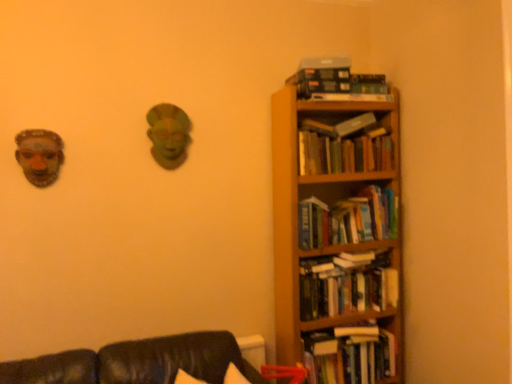
Question: From their relative heights in the image, would you say hardcover books at upper right, which is the first book in top-to-bottom order, is taller or shorter than wooden bookcase at right?

Choices:
 (A) tall
 (B) short

Answer: (B)

Question: Do you think hardcover books at upper right, which is the first book in top-to-bottom order, is within wooden bookcase at right, or outside of it?

Choices:
 (A) outside
 (B) inside

Answer: (B)

Question: Which object is positioned farthest from the hardcover book at upper right?

Choices:
 (A) hardcover books at right, acting as the fourth book starting from the top
 (B) hardcover books at right, the 2th book positioned from the top
 (C) hardcover books at upper right, which is counted as the 5th book, starting from the bottom
 (D) hardcover books at right, the 5th book from the top
 (E) matte brown mask at left

Answer: (E)

Question: Which of these objects is positioned closest to the hardcover books at right, which is the third book from bottom to top?

Choices:
 (A) hardcover book at upper right
 (B) matte brown mask at left
 (C) hardcover books at right, the 2th book positioned from the top
 (D) hardcover books at right, which appears as the 2th book when ordered from the bottom
 (E) hardcover books at right, the 5th book from the top

Answer: (D)